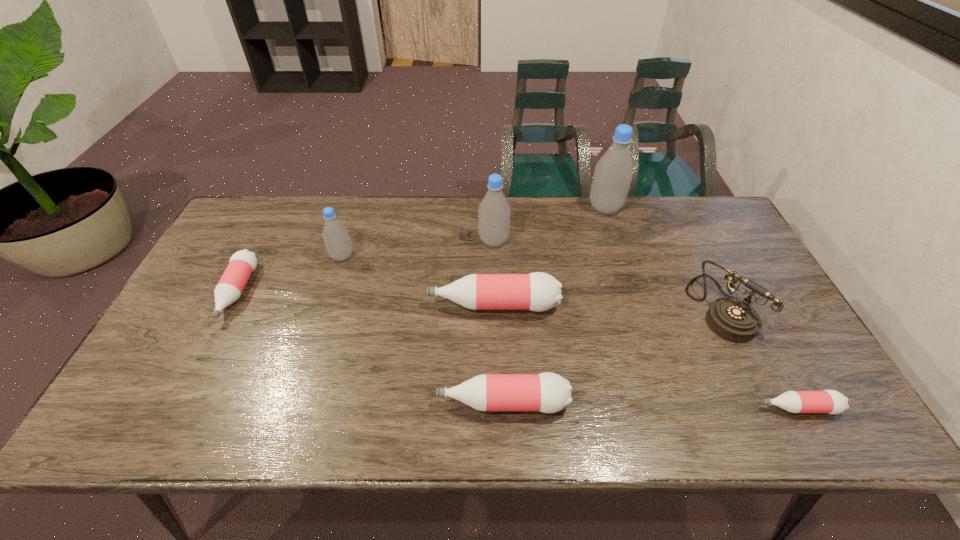
Locate an element on the screen. free space located with the cap open on the biggest pink bottle is located at coordinates (282, 305).

Locate an element on the screen. free space located with the cap open on the biggest pink bottle is located at coordinates (312, 305).

Where is `vacant area located 0.330m with the cap open on the third shortest object`? vacant area located 0.330m with the cap open on the third shortest object is located at coordinates (294, 402).

Where is `free location located with the cap open on the third shortest object`? free location located with the cap open on the third shortest object is located at coordinates (380, 402).

Find the location of a particular element. This screenshot has width=960, height=540. vacant space situated 0.320m with the cap open on the third shortest object is located at coordinates (298, 402).

Find the location of a particular element. blank space located 0.290m with the cap open on the leftmost pink bottle is located at coordinates (166, 431).

In order to click on free space located with the cap open on the rightmost bottle in this screenshot , I will do `click(649, 408)`.

Where is `vacant region located with the cap open on the rightmost bottle`? The width and height of the screenshot is (960, 540). vacant region located with the cap open on the rightmost bottle is located at coordinates (618, 408).

The width and height of the screenshot is (960, 540). Find the location of `free space located 0.230m with the cap open on the rightmost bottle`. free space located 0.230m with the cap open on the rightmost bottle is located at coordinates (658, 408).

What are the coordinates of `object located at the left edge` in the screenshot? It's located at (242, 263).